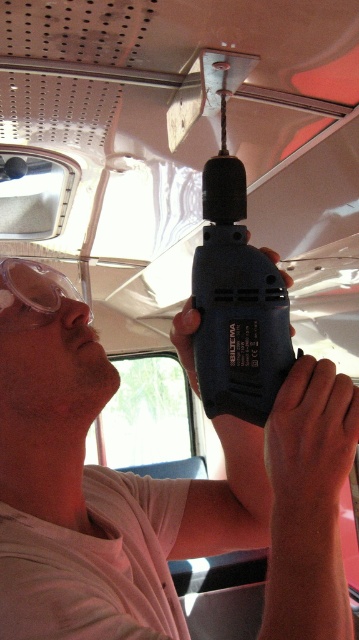
You are an inspector checking the safety equipment in the van. You notice the black plastic drill at center and the clear plastic goggles at left. Which object has a smaller diameter?

The black plastic drill at center is thinner than clear plastic goggles at left, so the drill has a smaller diameter.

You are a technician inside a vehicle and need to reach the clear plastic goggles at left while holding the black plastic drill at center. Can you extend your arm to grab the goggles without letting go of the drill?

The black plastic drill at center is 9.17 inches from clear plastic goggles at left. Since the distance between them is about 9.17 inches, it is possible to extend your arm to reach the goggles while holding the drill, as this distance is within typical human arm reach.

You are a safety inspector checking the workspace of the person in the vehicle. You notice the matte black drill at upper center and the clear plastic goggles at left. Based on standard safety protocols, is the drill positioned in a safe location relative to the goggles?

The matte black drill at upper center is located below the clear plastic goggles at left, which means it is positioned safely below eye level. This placement reduces the risk of debris or flying particles from the drill reaching the goggles and the person.